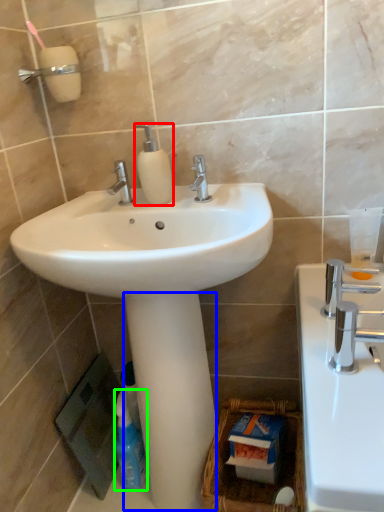
Question: Which object is positioned closest to soap dispenser (highlighted by a red box)? Select from pillar (highlighted by a blue box) and cleaning product (highlighted by a green box).

Choices:
 (A) pillar
 (B) cleaning product

Answer: (A)